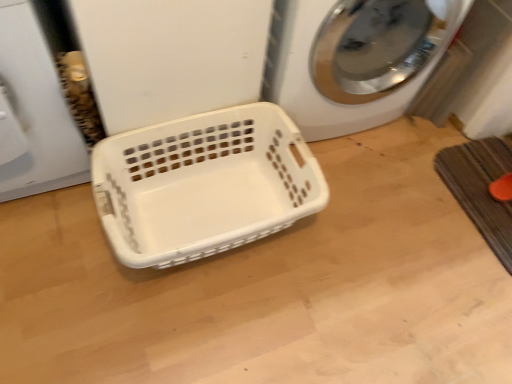
Locate an element on the screen. free point below white plastic basket at center (from a real-world perspective) is located at coordinates (210, 210).